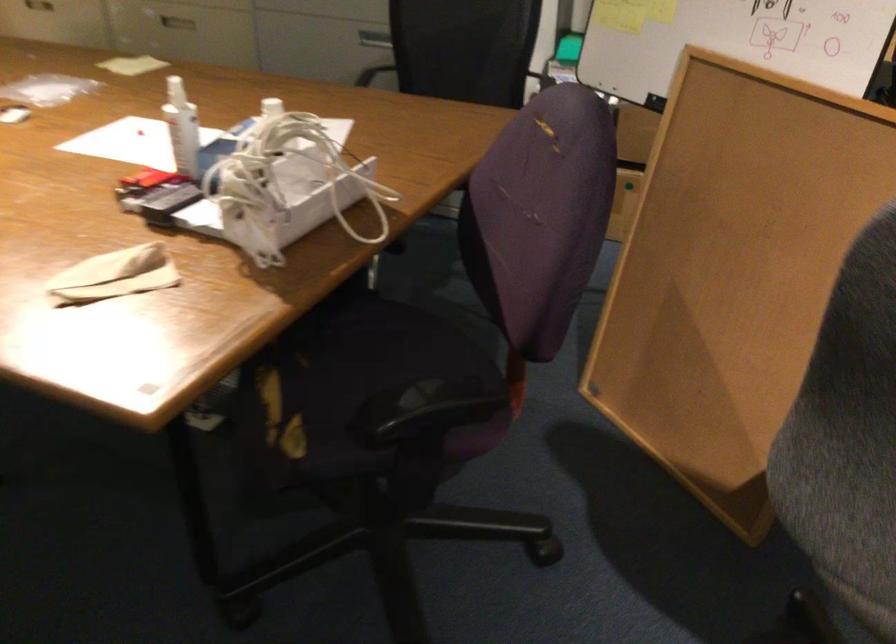
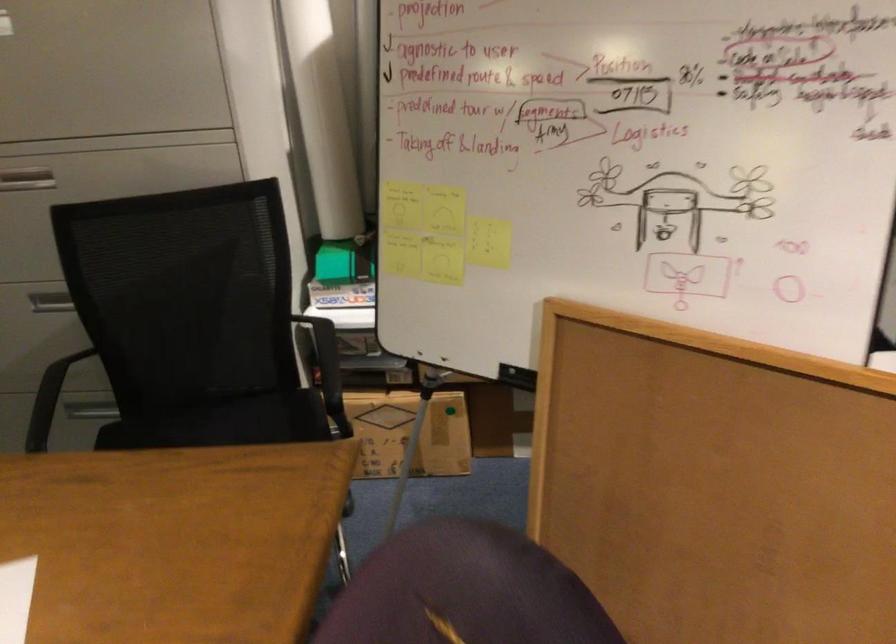
Question: The images are taken continuously from a first-person perspective. In which direction is your viewpoint rotating?

Choices:
 (A) Left
 (B) Right
 (C) Up
 (D) Down

Answer: (B)